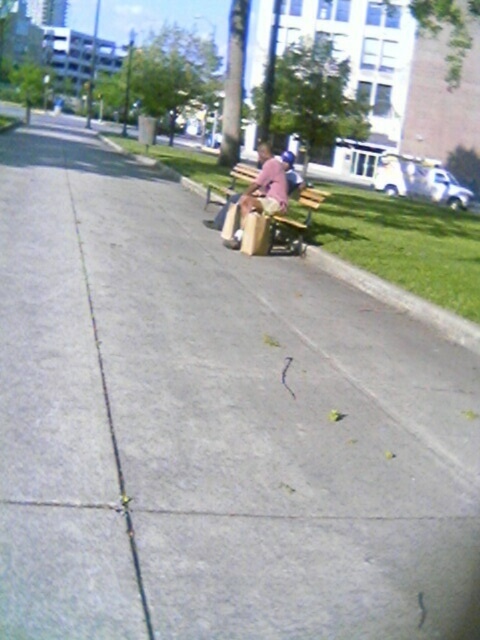
You are a photographer standing on the sidewalk and want to capture a photo of the pink fabric shirt at center and the wooden park bench at center. Based on their positions, which object should you frame first in your camera viewfinder to ensure both are included in the shot?

The pink fabric shirt at center is positioned on the left side of wooden park bench at center, so you should frame the wooden park bench at center first to ensure the pink fabric shirt at center, which is to its left, is also captured in the shot.

You are a gardener who needs to mow the green grass at lower right and trim the wooden park bench at center. Which task should you tackle first if you want to work on the taller object first?

The green grass at lower right is taller than the wooden park bench at center, so you should mow the green grass at lower right first.